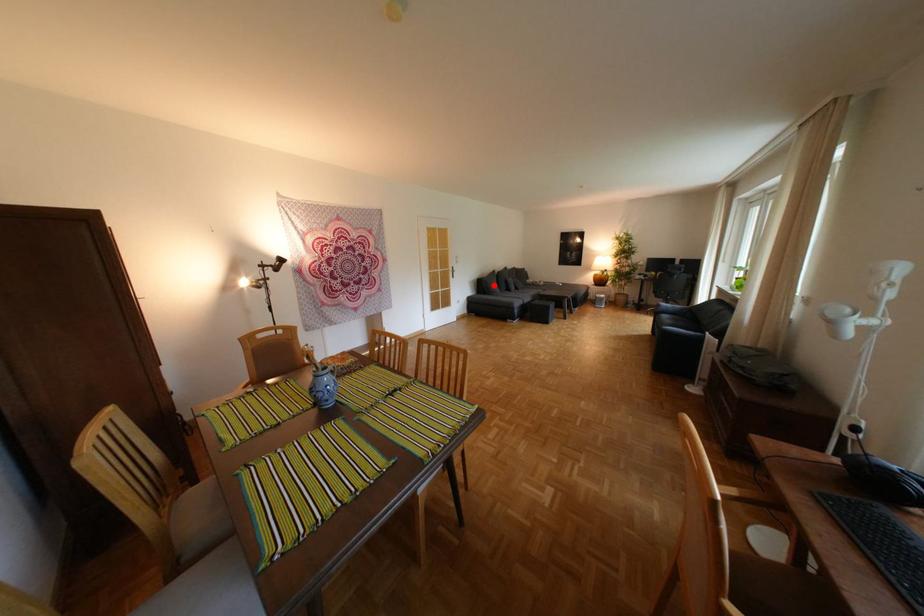
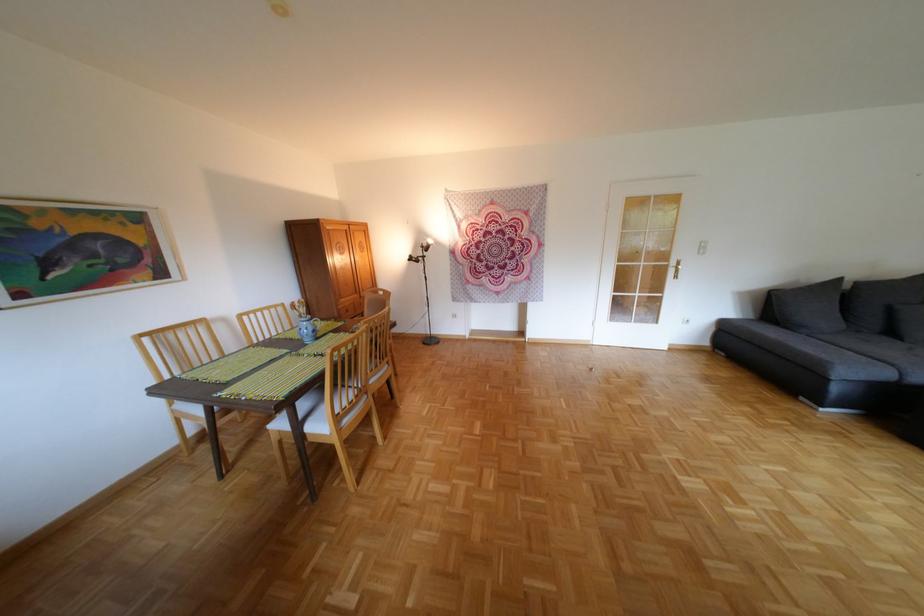
Question: I am providing you with two images of the same scene from different viewpoints. A red point is shown in image1. For the corresponding object point in image2, is it positioned nearer or farther from the camera?

Choices:
 (A) Nearer
 (B) Farther

Answer: (B)